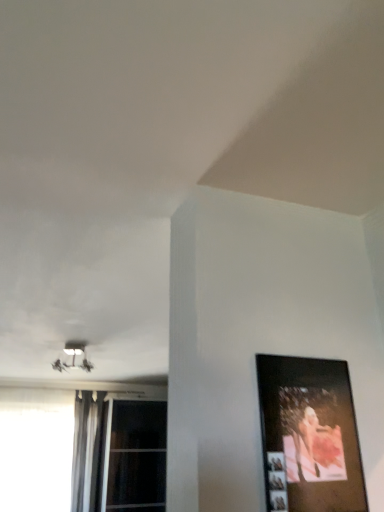
Question: Is wooden picture frame at right at the right side of white plastic lamp at upper left?

Choices:
 (A) yes
 (B) no

Answer: (A)

Question: Considering the relative sizes of wooden picture frame at right and white plastic lamp at upper left in the image provided, is wooden picture frame at right taller than white plastic lamp at upper left?

Choices:
 (A) no
 (B) yes

Answer: (B)

Question: Would you say wooden picture frame at right is outside white plastic lamp at upper left?

Choices:
 (A) no
 (B) yes

Answer: (B)

Question: From the image's perspective, would you say wooden picture frame at right is shown under white plastic lamp at upper left?

Choices:
 (A) yes
 (B) no

Answer: (B)

Question: Is wooden picture frame at right further to camera compared to white plastic lamp at upper left?

Choices:
 (A) no
 (B) yes

Answer: (A)

Question: From the image's perspective, is transparent glass window at lower left, acting as the 1th window starting from the right, positioned above or below wooden picture frame at right?

Choices:
 (A) above
 (B) below

Answer: (B)

Question: In the image, is transparent glass window at lower left, which is the second window from left to right, on the left side or the right side of wooden picture frame at right?

Choices:
 (A) left
 (B) right

Answer: (A)

Question: Considering the positions of transparent glass window at lower left, acting as the 1th window starting from the right, and wooden picture frame at right in the image, is transparent glass window at lower left, acting as the 1th window starting from the right, bigger or smaller than wooden picture frame at right?

Choices:
 (A) big
 (B) small

Answer: (A)

Question: Is transparent glass window at lower left, which is the second window from left to right, situated inside wooden picture frame at right or outside?

Choices:
 (A) outside
 (B) inside

Answer: (A)

Question: Is white plastic lamp at upper left in front of or behind wooden picture frame at right in the image?

Choices:
 (A) behind
 (B) front

Answer: (A)

Question: From a real-world perspective, is white plastic lamp at upper left physically located above or below wooden picture frame at right?

Choices:
 (A) above
 (B) below

Answer: (A)

Question: Considering the positions of point (86, 343) and point (357, 443), is point (86, 343) closer or farther from the camera than point (357, 443)?

Choices:
 (A) closer
 (B) farther

Answer: (B)

Question: Considering the positions of white plastic lamp at upper left and wooden picture frame at right in the image, is white plastic lamp at upper left bigger or smaller than wooden picture frame at right?

Choices:
 (A) big
 (B) small

Answer: (A)

Question: Considering the positions of point (72, 361) and point (91, 392), is point (72, 361) closer or farther from the camera than point (91, 392)?

Choices:
 (A) closer
 (B) farther

Answer: (A)

Question: Would you say white plastic lamp at upper left is to the left or to the right of silky gray curtain at left in the picture?

Choices:
 (A) right
 (B) left

Answer: (A)